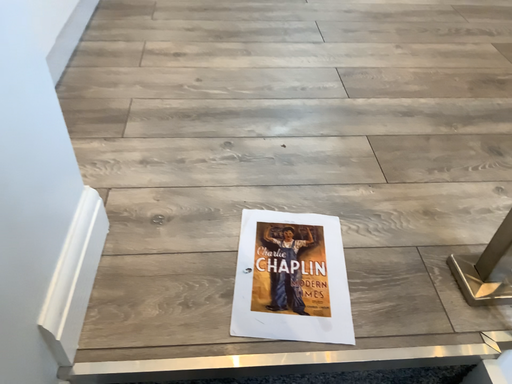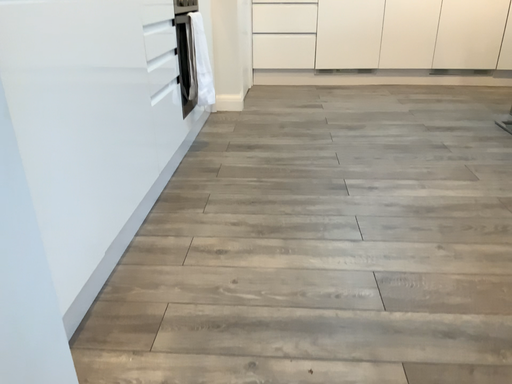
Question: How did the camera likely rotate when shooting the video?

Choices:
 (A) rotated left
 (B) rotated right

Answer: (A)